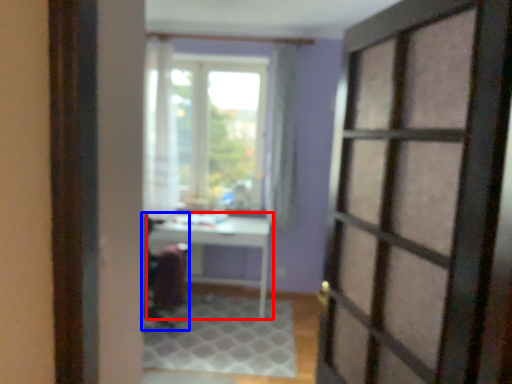
Question: Which object appears closest to the camera in this image, table (highlighted by a red box) or armchair (highlighted by a blue box)?

Choices:
 (A) table
 (B) armchair

Answer: (B)